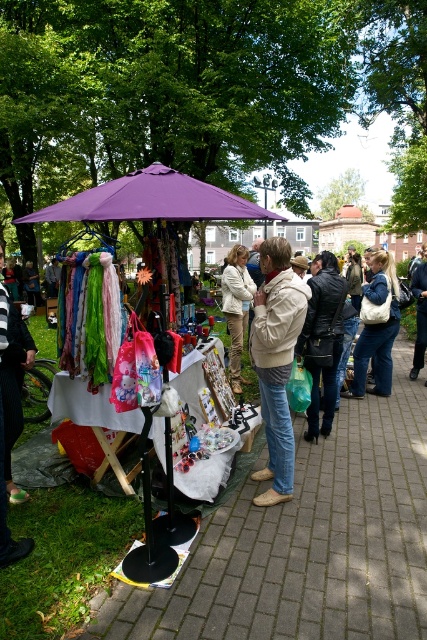
You are organizing items at the vendor stall and need to place the matte plastic bag at center and light beige jacket at center side by side on a shelf. Which item requires more horizontal space?

The matte plastic bag at center requires more horizontal space because its width is larger than the light beige jacket at center.